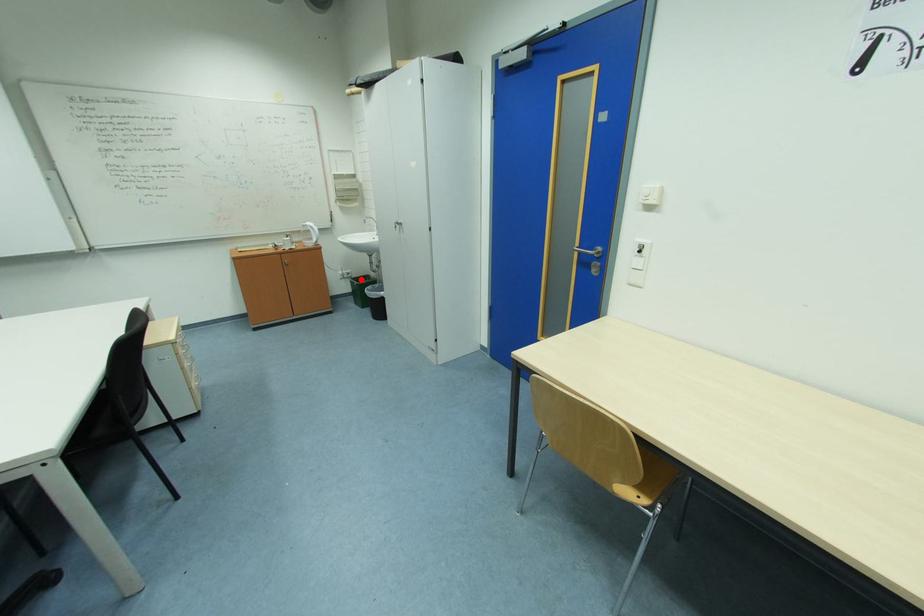
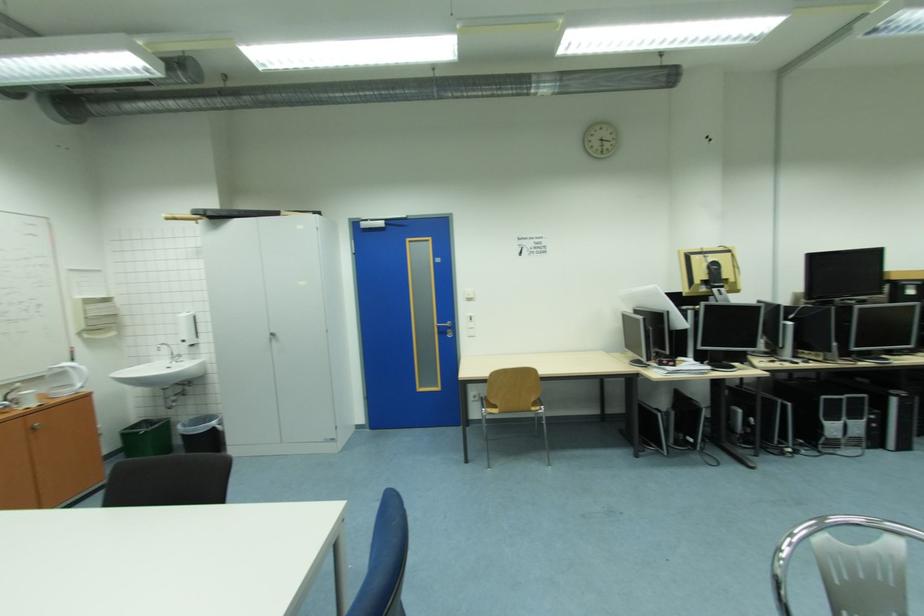
The point at the highlighted location is marked in the first image. Where is the corresponding point in the second image?

(130, 431)